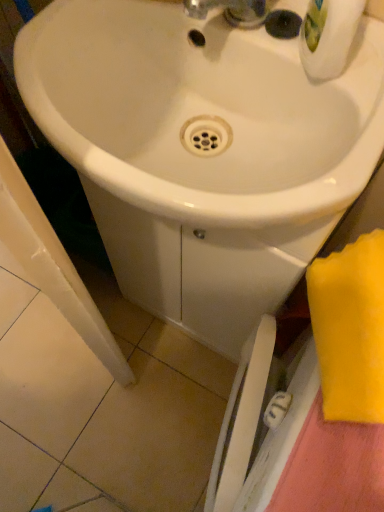
Question: Should I look upward or downward to see white glossy sink at center?

Choices:
 (A) down
 (B) up

Answer: (B)

Question: From a real-world perspective, is yellow fabric towel at lower right positioned under white glossy sink at center based on gravity?

Choices:
 (A) no
 (B) yes

Answer: (A)

Question: From the image's perspective, is yellow fabric towel at lower right below white glossy sink at center?

Choices:
 (A) no
 (B) yes

Answer: (B)

Question: Is white glossy sink at center at the back of yellow fabric towel at lower right?

Choices:
 (A) yes
 (B) no

Answer: (B)

Question: From the image's perspective, is yellow fabric towel at lower right on top of white glossy sink at center?

Choices:
 (A) no
 (B) yes

Answer: (A)

Question: Does yellow fabric towel at lower right have a lesser height compared to white glossy sink at center?

Choices:
 (A) yes
 (B) no

Answer: (A)

Question: Is yellow fabric towel at lower right oriented towards white glossy sink at center?

Choices:
 (A) no
 (B) yes

Answer: (A)

Question: Can you confirm if white glossy sink at center is thinner than yellow fabric towel at lower right?

Choices:
 (A) yes
 (B) no

Answer: (B)

Question: From a real-world perspective, is white glossy sink at center on yellow fabric towel at lower right?

Choices:
 (A) yes
 (B) no

Answer: (B)

Question: Can you confirm if white glossy sink at center is shorter than yellow fabric towel at lower right?

Choices:
 (A) yes
 (B) no

Answer: (B)

Question: Is white glossy sink at center positioned far away from yellow fabric towel at lower right?

Choices:
 (A) yes
 (B) no

Answer: (B)

Question: From the image's perspective, does white glossy sink at center appear lower than yellow fabric towel at lower right?

Choices:
 (A) yes
 (B) no

Answer: (B)

Question: Does white glossy sink at center have a greater height compared to yellow fabric towel at lower right?

Choices:
 (A) no
 (B) yes

Answer: (B)

Question: Is white glossy sink at center wider or thinner than yellow fabric towel at lower right?

Choices:
 (A) thin
 (B) wide

Answer: (B)